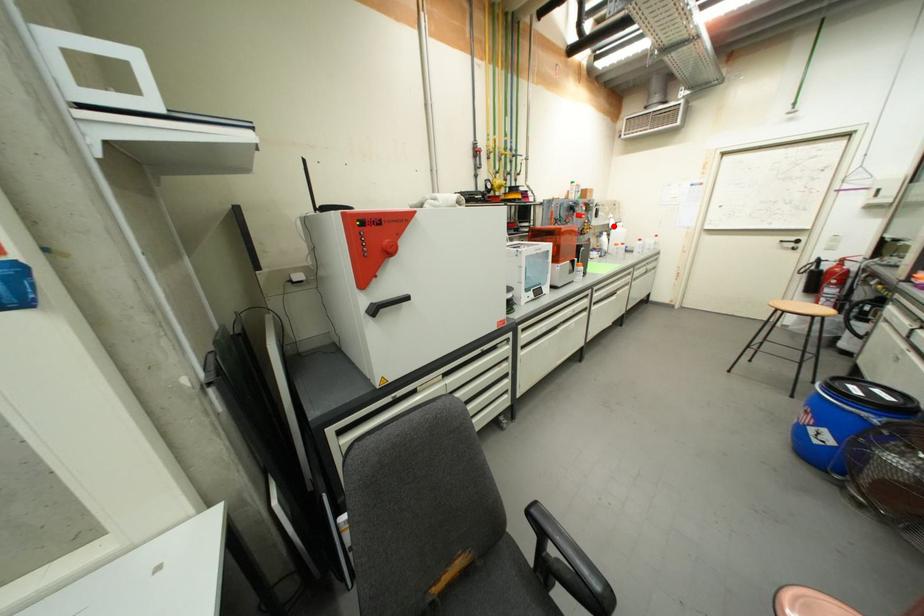
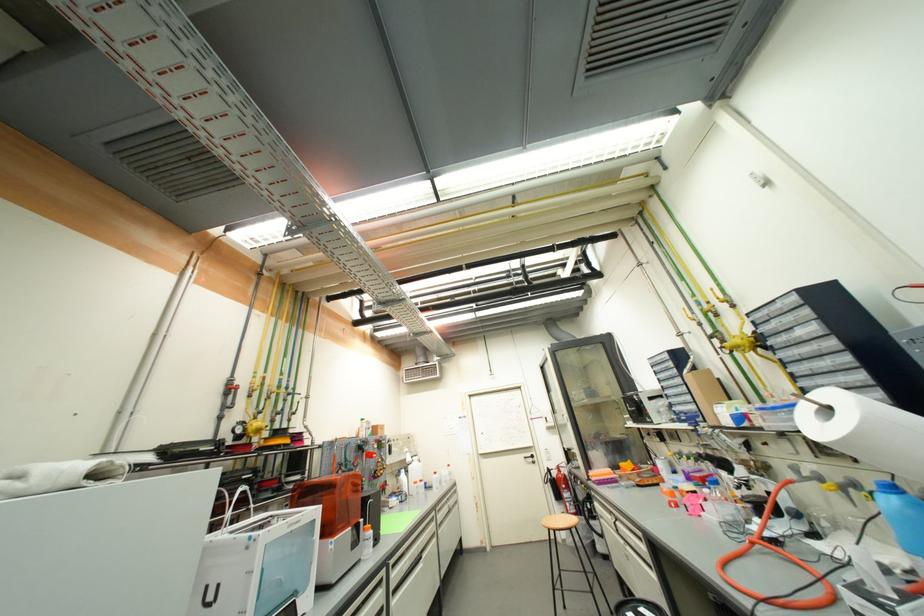
Where in the second image is the point corresponding to the highlighted location from the first image?

(410, 461)